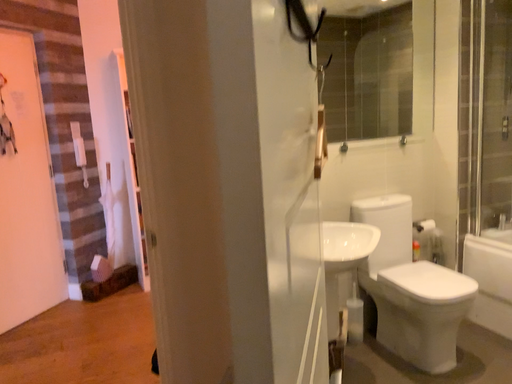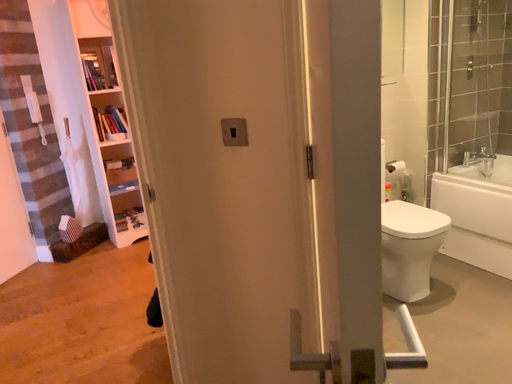
Question: How did the camera likely rotate when shooting the video?

Choices:
 (A) rotated right
 (B) rotated left

Answer: (A)